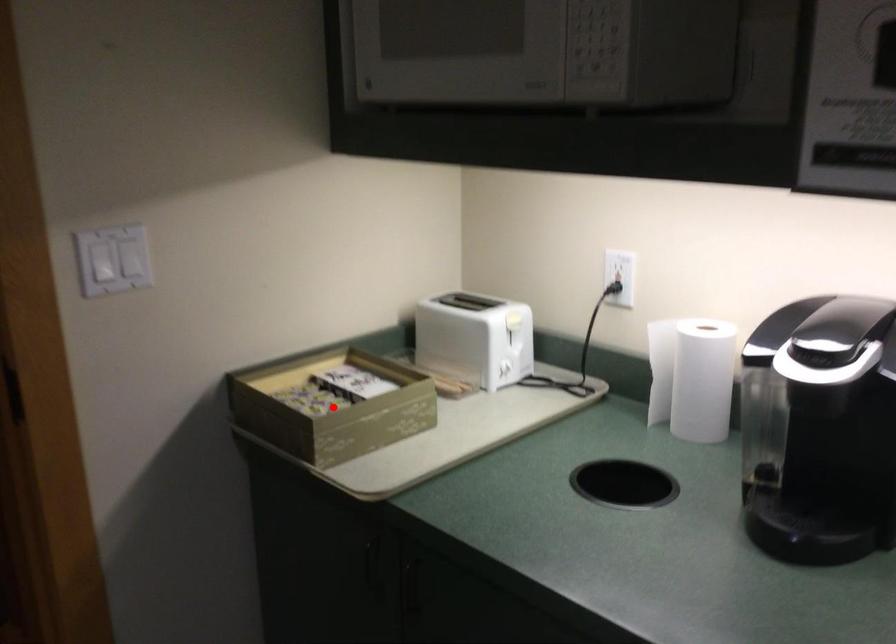
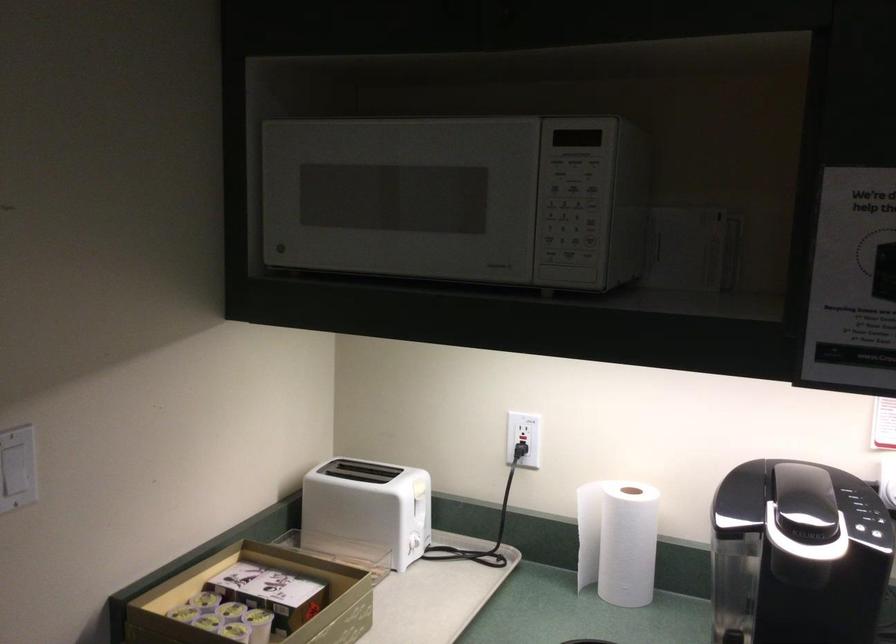
The point at the highlighted location is marked in the first image. Where is the corresponding point in the second image?

(259, 625)